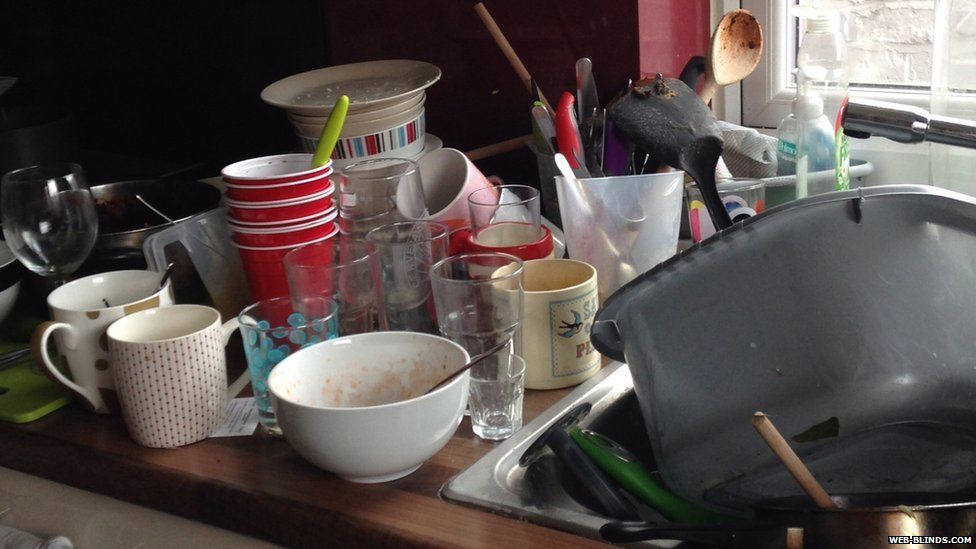
Locate an element on the screen. shot glass is located at coordinates (497, 402).